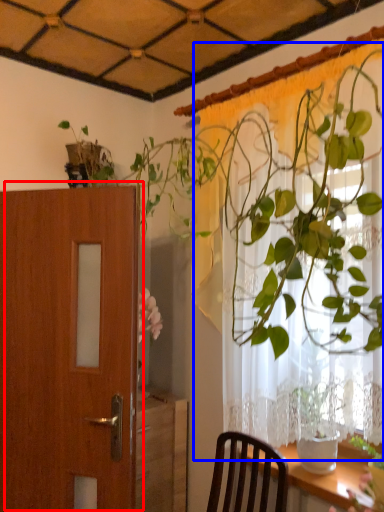
Question: Which of the following is the closest to the observer, door (highlighted by a red box) or curtain (highlighted by a blue box)?

Choices:
 (A) door
 (B) curtain

Answer: (B)